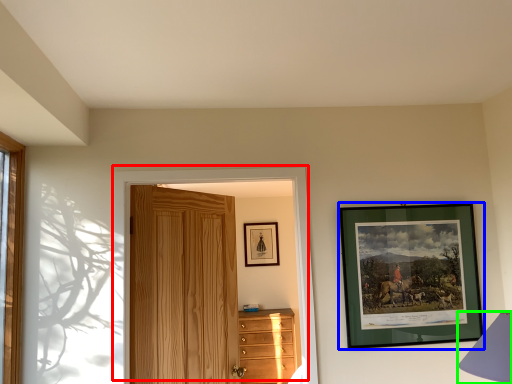
Question: Which object is the farthest from door (highlighted by a red box)? Choose among these: picture frame (highlighted by a blue box) or table lamp (highlighted by a green box).

Choices:
 (A) picture frame
 (B) table lamp

Answer: (B)